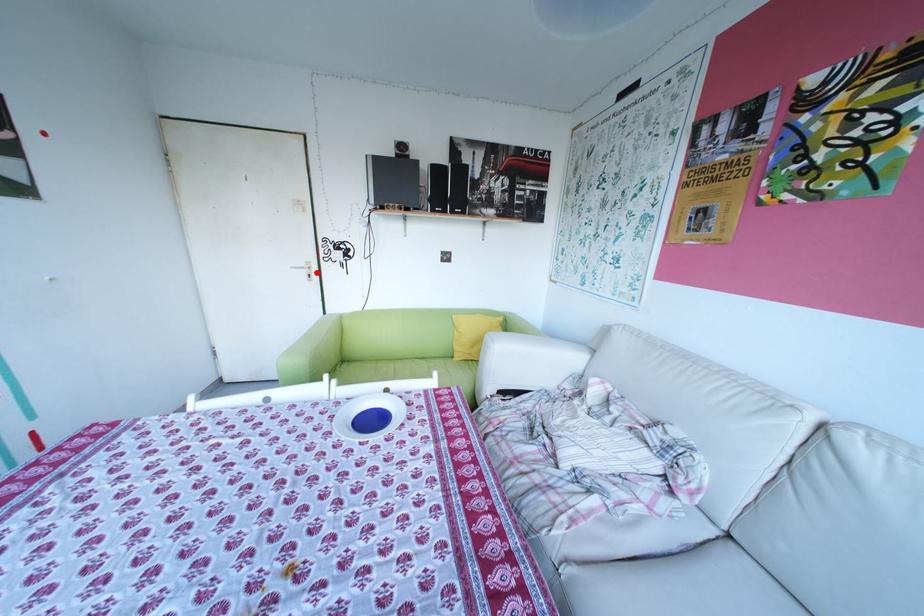
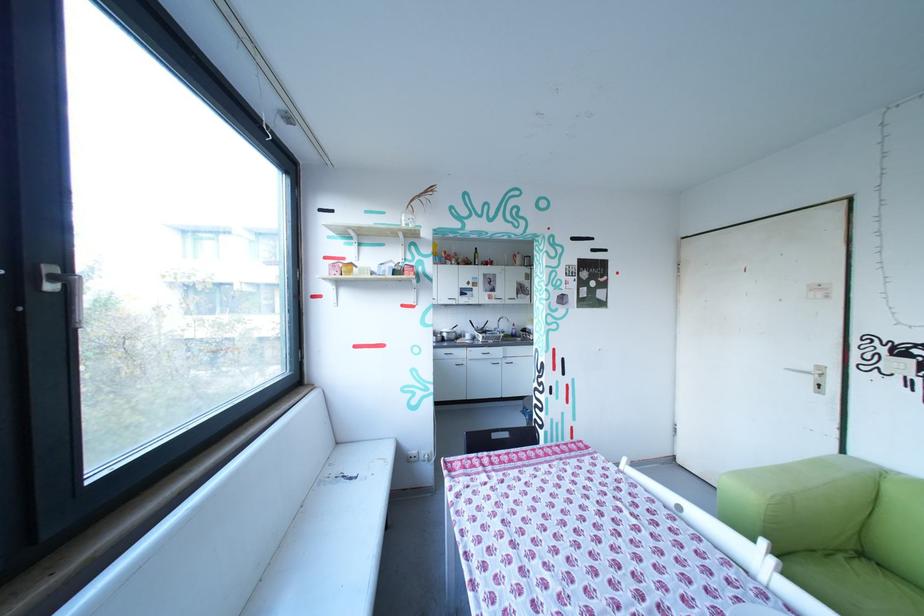
Where in the second image is the point corresponding to the highlighted location from the first image?

(821, 379)